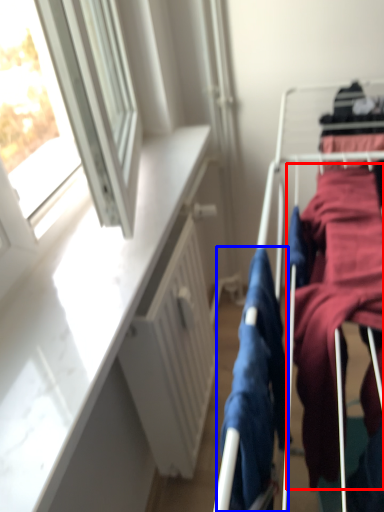
Question: Which of the following is the closest to the observer, clothing (highlighted by a red box) or clothing (highlighted by a blue box)?

Choices:
 (A) clothing
 (B) clothing

Answer: (B)